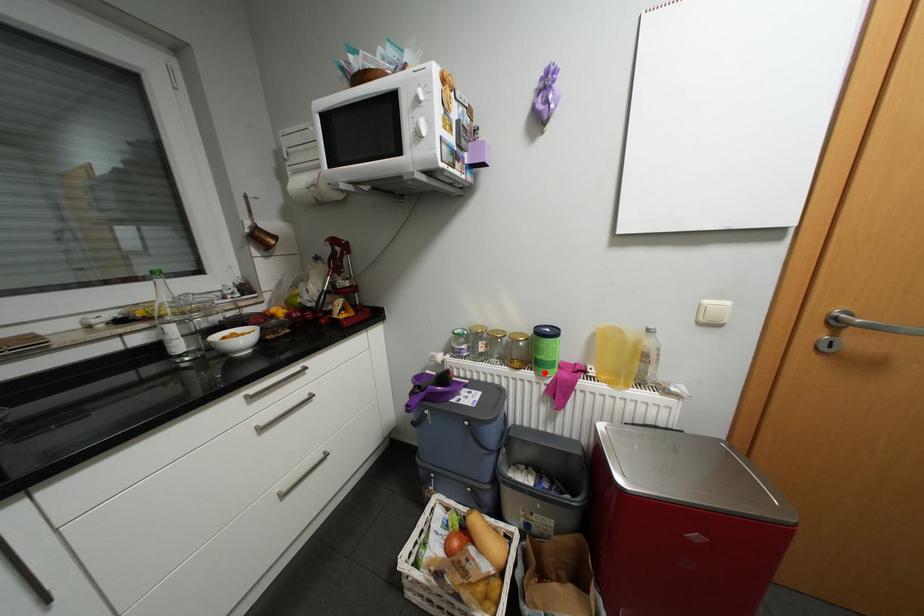
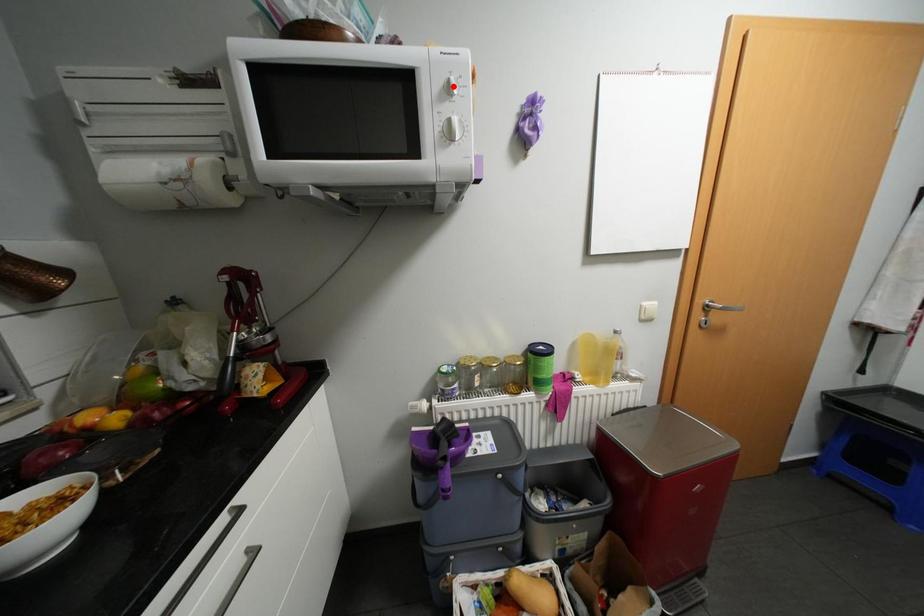
I am providing you with two images of the same scene from different viewpoints. A red point is marked on the first image and another point is marked on the second image. Does the point marked in image1 correspond to the same location as the one in image2?

No